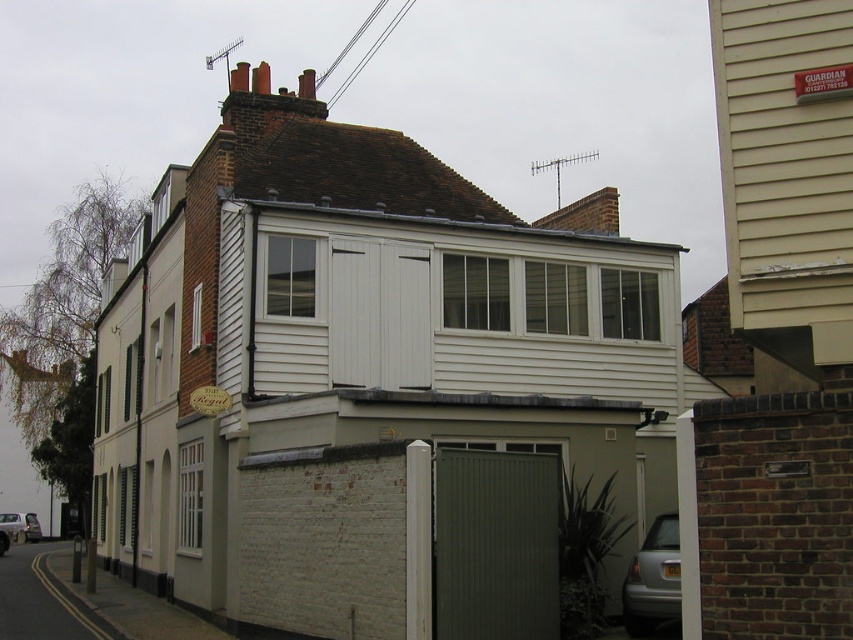
Question: Among these points, which one is farthest from the camera?

Choices:
 (A) (483, 545)
 (B) (119, 435)

Answer: (B)

Question: Can you confirm if white wood shed at center is positioned above dark green corrugated metal at center?

Choices:
 (A) yes
 (B) no

Answer: (A)

Question: Which point is farther to the camera?

Choices:
 (A) (555, 301)
 (B) (519, 540)

Answer: (A)

Question: Does white wood shed at center have a greater width compared to dark green corrugated metal at center?

Choices:
 (A) no
 (B) yes

Answer: (B)

Question: Observing the image, what is the correct spatial positioning of white wood shed at center in reference to dark green corrugated metal at center?

Choices:
 (A) below
 (B) above

Answer: (B)